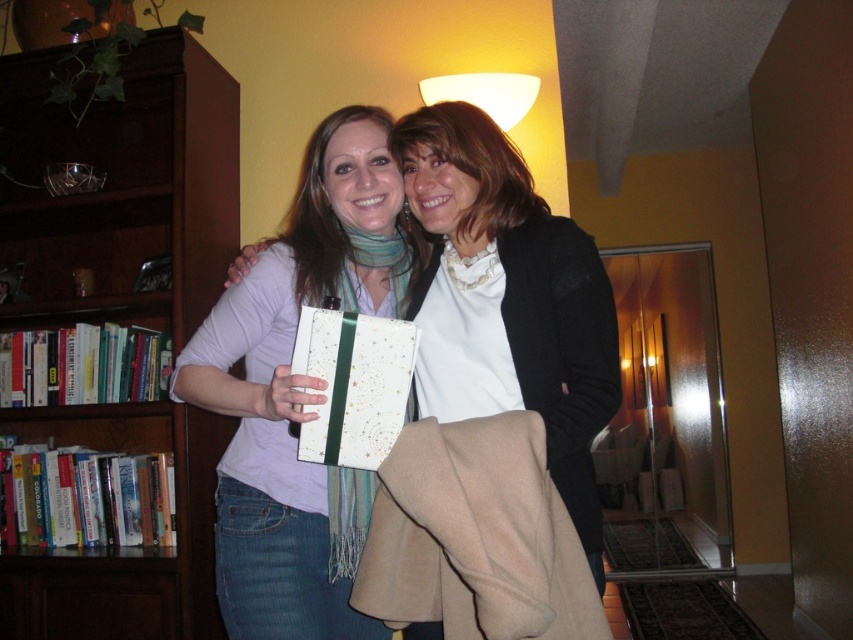
Where is the multicolored woven scarf at center located in the image?

The multicolored woven scarf at center is located at point coordinates of (373, 268).

You are a delivery person who needs to place a package between the matte black jacket at center and the white matte lampshade at upper center. The package measures 90 centimeters in length. Will it fit in the space between them?

The distance between the matte black jacket at center and the white matte lampshade at upper center is 88.91 centimeters. Since the package is 90 centimeters long, it will not fit in the space between them.

You are standing in a living room and want to place a small decorative bowl on the bookshelf. The bookshelf is located at the coordinates point (123, 188). Where should you place the bowl to ensure it is on the bookshelf?

The point (123, 188) corresponds to the brown wood bookcase at left, so placing the bowl there would place it on the bookshelf.